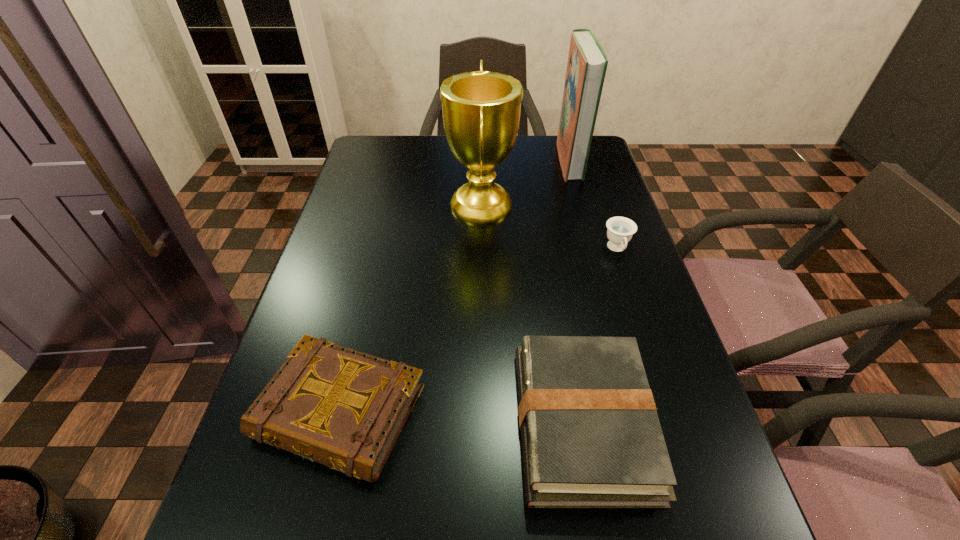
Find the location of a particular element. Image resolution: width=960 pixels, height=540 pixels. the farthest hardback book is located at coordinates (587, 63).

Where is `award`? The height and width of the screenshot is (540, 960). award is located at coordinates (481, 109).

Identify the location of the second tallest hardback book. (591, 438).

Locate an element on the screen. The height and width of the screenshot is (540, 960). teacup is located at coordinates (620, 230).

This screenshot has height=540, width=960. Identify the location of the shortest hardback book. (345, 409).

Locate an element on the screen. The image size is (960, 540). the leftmost hardback book is located at coordinates (345, 409).

Where is `vacant space located 0.340m on the cover of the farthest hardback book`? The image size is (960, 540). vacant space located 0.340m on the cover of the farthest hardback book is located at coordinates (453, 160).

At what (x,y) coordinates should I click in order to perform the action: click on vacant space located on the cover of the farthest hardback book. Please return your answer as a coordinate pair (x, y). Looking at the image, I should click on (478, 160).

Locate an element on the screen. The image size is (960, 540). free space located on the cover of the farthest hardback book is located at coordinates (471, 160).

I want to click on free space located 0.160m on the shiny surface of the award, so click(x=390, y=206).